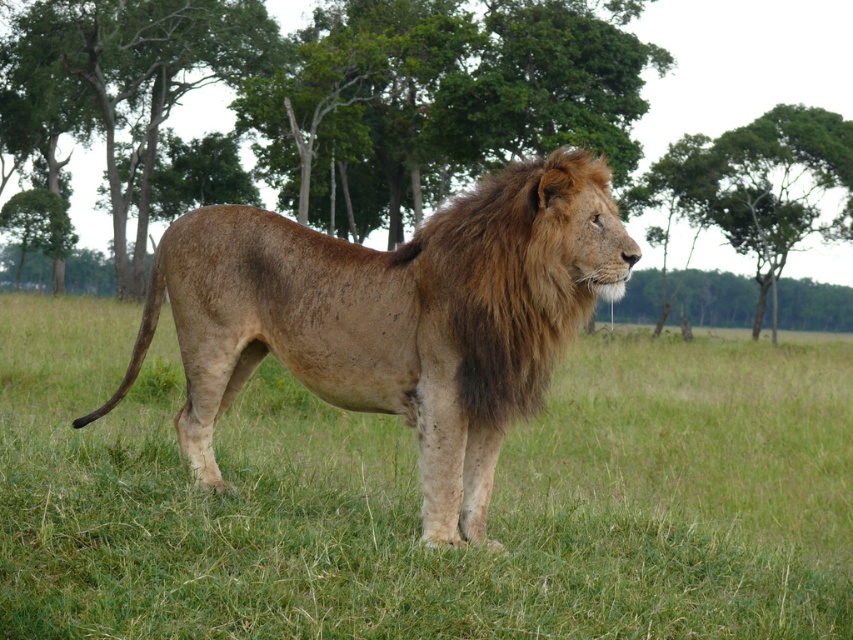
Question: Which point is farther from the camera taking this photo?

Choices:
 (A) (554, 276)
 (B) (262, 381)

Answer: (B)

Question: Which object is closer to the camera taking this photo?

Choices:
 (A) green grass at center
 (B) green leafy tree at upper center

Answer: (A)

Question: Does green grass at center come in front of green leafy tree at center?

Choices:
 (A) yes
 (B) no

Answer: (A)

Question: Which is nearer to the brown fur lion at center?

Choices:
 (A) green grass at center
 (B) green leafy tree at center

Answer: (A)

Question: Does green grass at center come behind brown fur lion at center?

Choices:
 (A) no
 (B) yes

Answer: (A)

Question: Does brown fur lion at center lie behind green leafy tree at upper center?

Choices:
 (A) no
 (B) yes

Answer: (A)